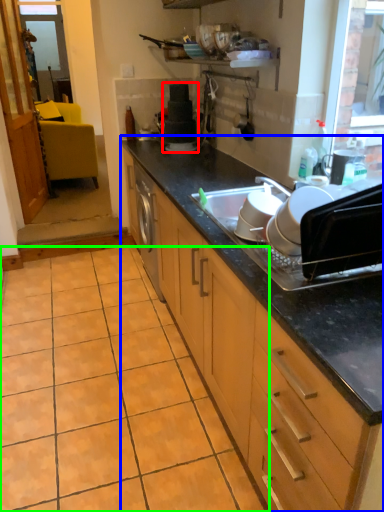
Question: Based on their relative distances, which object is nearer to appliance (highlighted by a red box)? Choose from cabinetry (highlighted by a blue box) and ceramic tile (highlighted by a green box).

Choices:
 (A) cabinetry
 (B) ceramic tile

Answer: (A)